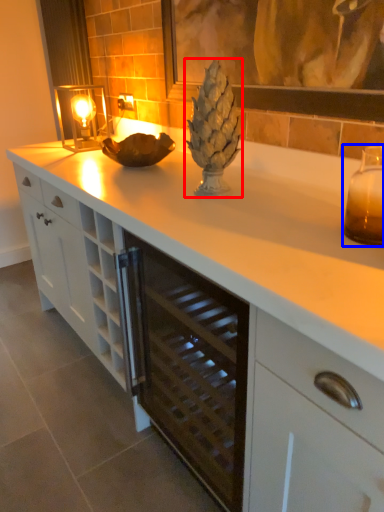
Question: Which object appears closest to the camera in this image, pineapple (highlighted by a red box) or candle holder (highlighted by a blue box)?

Choices:
 (A) pineapple
 (B) candle holder

Answer: (B)